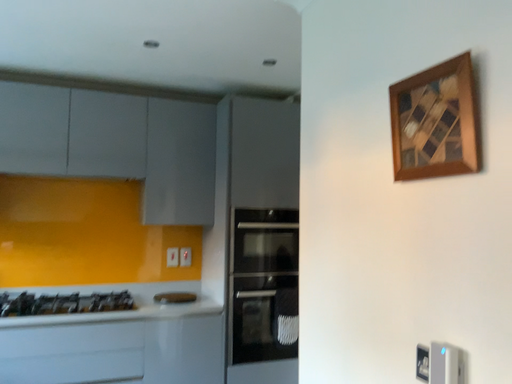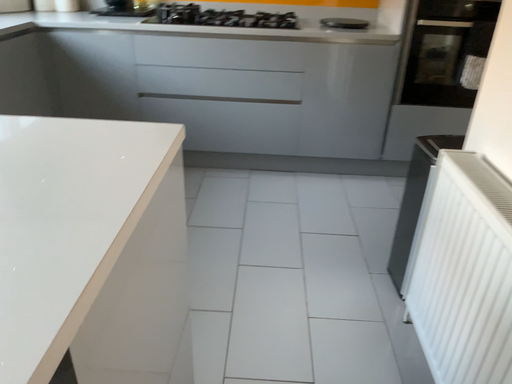
Question: How did the camera likely rotate when shooting the video?

Choices:
 (A) rotated upward
 (B) rotated downward

Answer: (B)